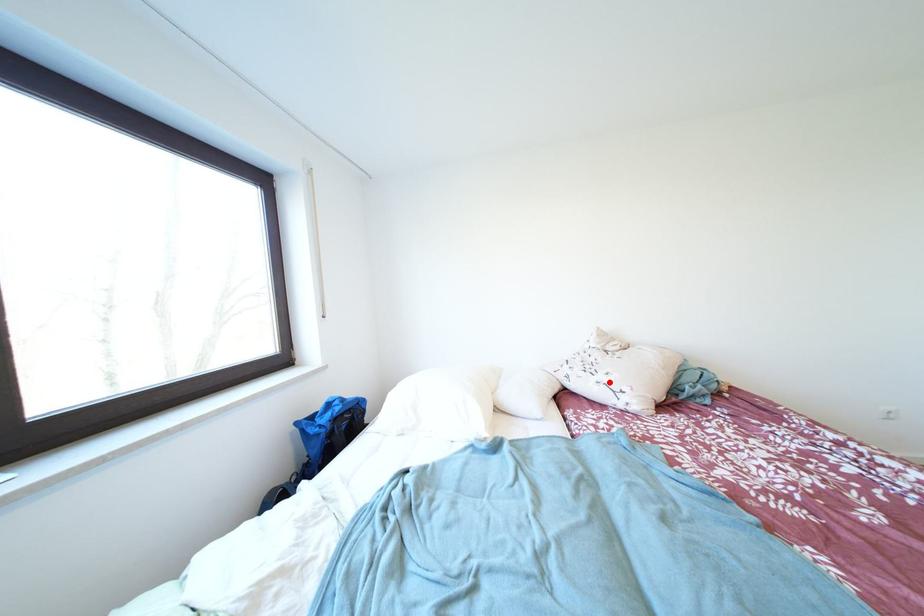
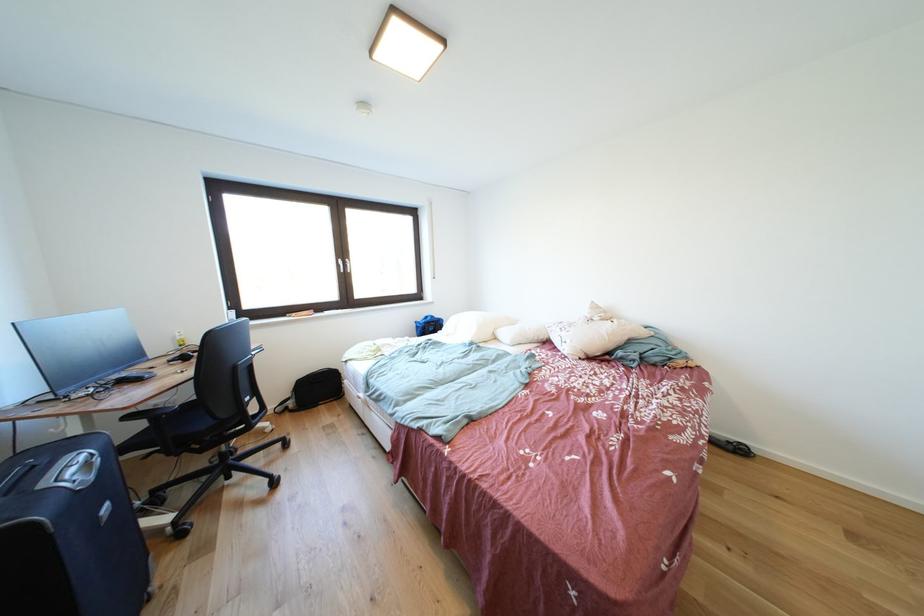
Question: A red point is marked in image1. In image2, is the corresponding 3D point closer to the camera or farther? Reply with the corresponding letter.

Choices:
 (A) The corresponding 3D point is closer.
 (B) The corresponding 3D point is farther.

Answer: (A)